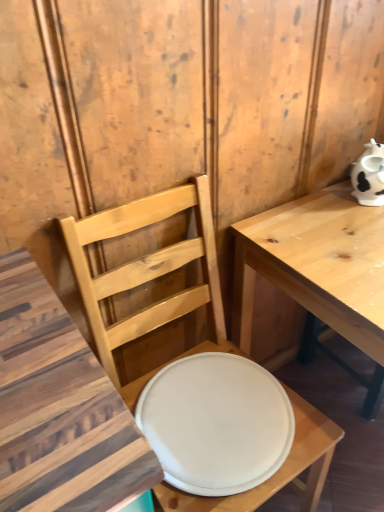
What are the coordinates of `free location above white matte plate at center (from a real-world perspective)` in the screenshot? It's located at (213, 407).